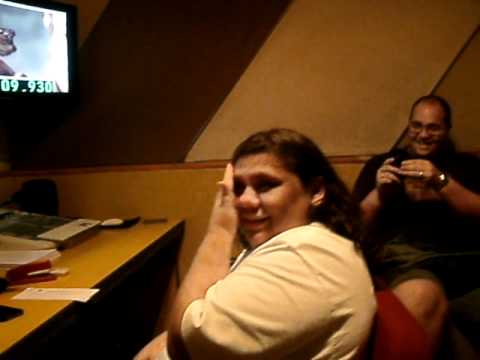
I want to click on desk, so click(112, 251).